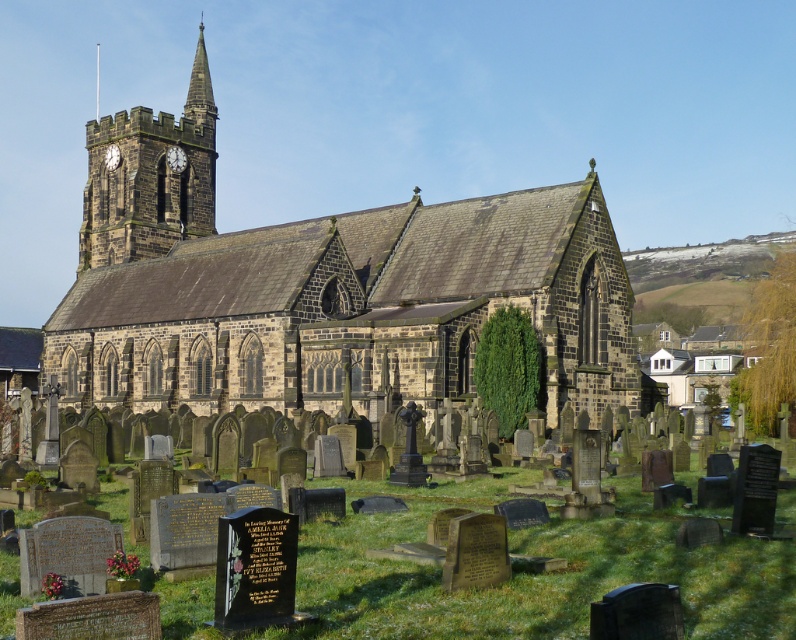
Question: Can you confirm if brown stone church at center is smaller than smooth stone spire at upper center?

Choices:
 (A) yes
 (B) no

Answer: (A)

Question: Considering the relative positions of gravestones at center and dark gray stone clock tower at upper left in the image provided, where is gravestones at center located with respect to dark gray stone clock tower at upper left?

Choices:
 (A) right
 (B) left

Answer: (A)

Question: Which of the following is the farthest from the observer?

Choices:
 (A) gravestones at center
 (B) brown stone church at center
 (C) smooth stone spire at upper center

Answer: (C)

Question: Which object appears farthest from the camera in this image?

Choices:
 (A) brown stone church at center
 (B) smooth stone spire at upper center
 (C) dark gray stone clock tower at upper left
 (D) gravestones at center

Answer: (B)

Question: From the image, what is the correct spatial relationship of brown stone church at center in relation to dark gray stone clock tower at upper left?

Choices:
 (A) right
 (B) left

Answer: (A)

Question: Estimate the real-world distances between objects in this image. Which object is closer to the smooth stone spire at upper center?

Choices:
 (A) dark gray stone clock tower at upper left
 (B) brown stone church at center

Answer: (A)